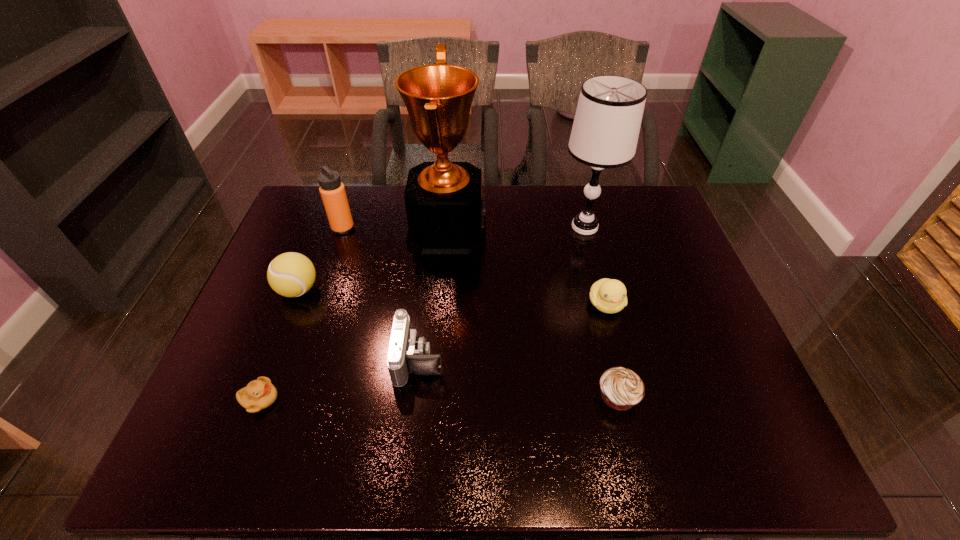
Identify the location of vacant space located 0.180m on the front of the trophy cup with the label. This screenshot has height=540, width=960. (543, 231).

Where is `free space located 0.270m on the left of the table lamp`? free space located 0.270m on the left of the table lamp is located at coordinates (470, 227).

You are a GUI agent. You are given a task and a screenshot of the screen. Output one action in this format:
    pyautogui.click(x=<x>, y=<y>)
    Task: Click on the vacant position located on the right of the thermos bottle
    
    Given the screenshot: What is the action you would take?
    pyautogui.click(x=431, y=228)

Where is `vacant space located on the front of the tennis ball`? vacant space located on the front of the tennis ball is located at coordinates 265,376.

Locate an element on the screen. The height and width of the screenshot is (540, 960). free space located 0.210m at the front of the camera with an open lens cover is located at coordinates (532, 359).

The image size is (960, 540). In order to click on vacant space located 0.240m at the beak of the farther duckling in this screenshot , I will do `click(633, 408)`.

Locate an element on the screen. The height and width of the screenshot is (540, 960). blank space located on the back of the muffin is located at coordinates (597, 307).

Where is `vacant region located at the beak of the shorter duckling`? This screenshot has width=960, height=540. vacant region located at the beak of the shorter duckling is located at coordinates (450, 400).

The height and width of the screenshot is (540, 960). Find the location of `trophy cup at the far edge`. trophy cup at the far edge is located at coordinates (445, 205).

Locate an element on the screen. The width and height of the screenshot is (960, 540). table lamp that is at the far edge is located at coordinates (606, 127).